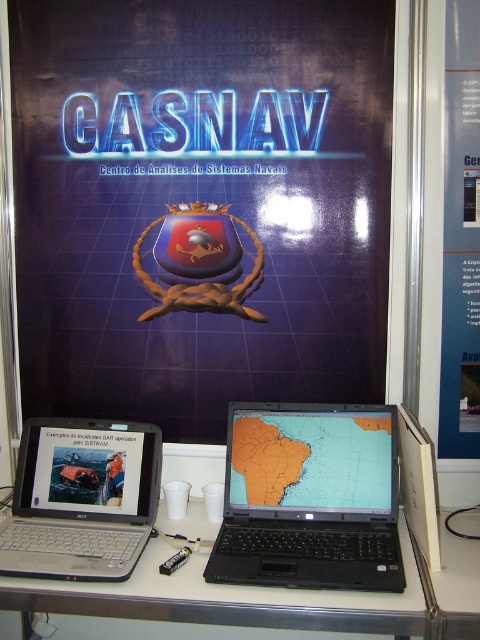
Question: Which point appears farthest from the camera in this image?

Choices:
 (A) pos(132,541)
 (B) pos(479,48)

Answer: (B)

Question: Is blue glossy poster at upper center to the left of orange matte map at center from the viewer's perspective?

Choices:
 (A) no
 (B) yes

Answer: (A)

Question: Which point is farther to the camera?

Choices:
 (A) (310, 141)
 (B) (304, 420)
 (C) (139, 445)
 (D) (301, 556)

Answer: (A)

Question: Does silver metallic computer desk at center have a smaller size compared to blue glossy poster at upper center?

Choices:
 (A) yes
 (B) no

Answer: (B)

Question: Estimate the real-world distances between objects in this image. Which object is farther from the black plastic laptop at center?

Choices:
 (A) orange matte map at center
 (B) blue glossy poster at upper center

Answer: (B)

Question: Can you confirm if black plastic laptop at center is bigger than orange matte map at center?

Choices:
 (A) no
 (B) yes

Answer: (B)